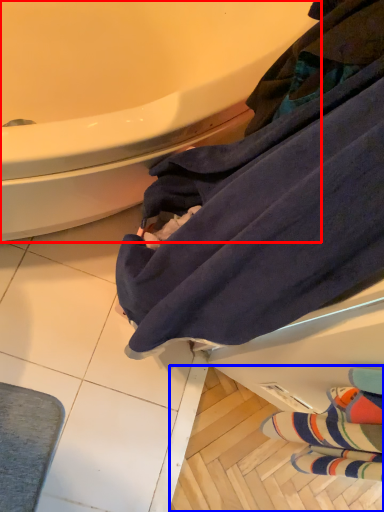
Question: Which object appears farthest to the camera in this image, bathtub (highlighted by a red box) or tile (highlighted by a blue box)?

Choices:
 (A) bathtub
 (B) tile

Answer: (B)